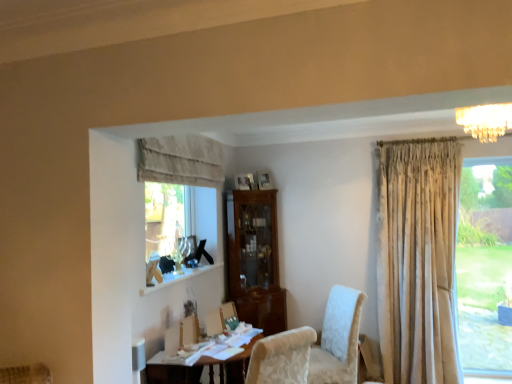
Question: Are neutral fabric curtain at upper center and crystal chandelier at upper right beside each other?

Choices:
 (A) yes
 (B) no

Answer: (B)

Question: Does neutral fabric curtain at upper center turn towards crystal chandelier at upper right?

Choices:
 (A) yes
 (B) no

Answer: (A)

Question: Is neutral fabric curtain at upper center to the right of crystal chandelier at upper right from the viewer's perspective?

Choices:
 (A) no
 (B) yes

Answer: (A)

Question: Considering the relative sizes of neutral fabric curtain at upper center and crystal chandelier at upper right in the image provided, is neutral fabric curtain at upper center taller than crystal chandelier at upper right?

Choices:
 (A) yes
 (B) no

Answer: (A)

Question: From the image's perspective, is neutral fabric curtain at upper center on top of crystal chandelier at upper right?

Choices:
 (A) yes
 (B) no

Answer: (B)

Question: From a real-world perspective, is neutral fabric curtain at upper center on top of crystal chandelier at upper right?

Choices:
 (A) yes
 (B) no

Answer: (B)

Question: Does crystal chandelier at upper right turn towards wooden table at lower center?

Choices:
 (A) yes
 (B) no

Answer: (B)

Question: Considering the relative positions of crystal chandelier at upper right and wooden table at lower center in the image provided, is crystal chandelier at upper right to the left of wooden table at lower center from the viewer's perspective?

Choices:
 (A) yes
 (B) no

Answer: (B)

Question: Is crystal chandelier at upper right wider than wooden table at lower center?

Choices:
 (A) no
 (B) yes

Answer: (A)

Question: From a real-world perspective, is crystal chandelier at upper right physically below wooden table at lower center?

Choices:
 (A) no
 (B) yes

Answer: (A)

Question: From the image's perspective, is crystal chandelier at upper right over wooden table at lower center?

Choices:
 (A) yes
 (B) no

Answer: (A)

Question: Is crystal chandelier at upper right surrounding wooden table at lower center?

Choices:
 (A) yes
 (B) no

Answer: (B)

Question: Can you confirm if wooden table at lower center is positioned to the right of neutral fabric curtain at upper center?

Choices:
 (A) no
 (B) yes

Answer: (B)